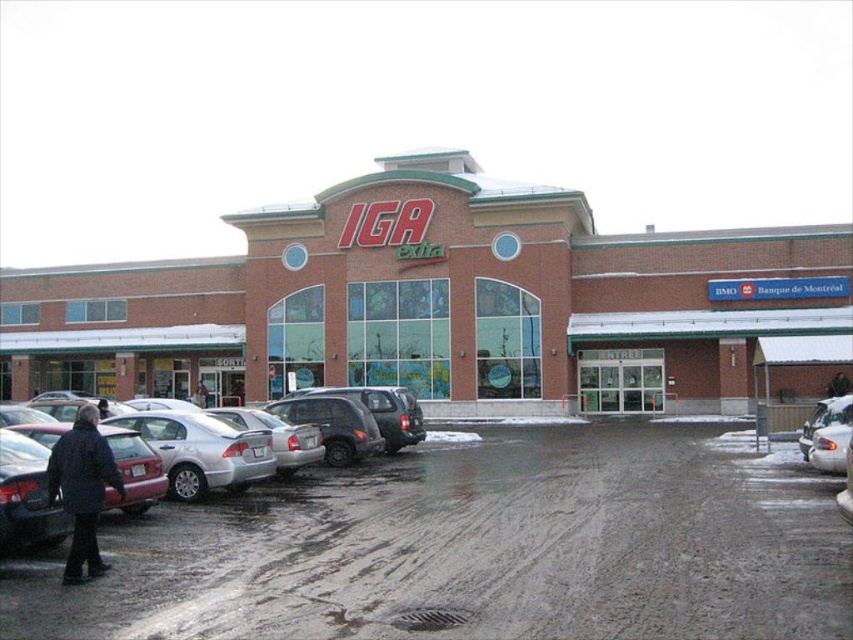
You are a delivery person trying to park your van in the parking lot of the IGA Extra store. You see the brown brick building at center and the dark blue jacket at lower left. Which object is bigger in size?

The brown brick building at center is larger in size compared to the dark blue jacket at lower left, so the brown brick building at center is bigger.